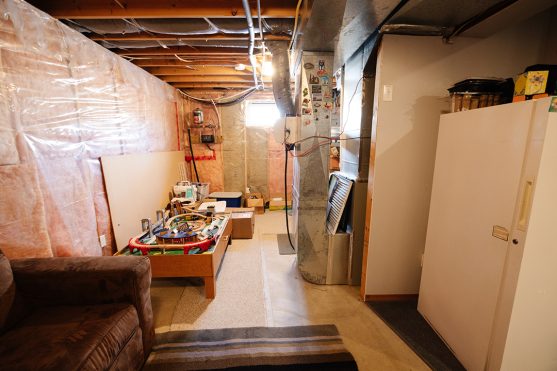
Locate an element on the screen. Image resolution: width=557 pixels, height=371 pixels. table leg is located at coordinates (210, 286).